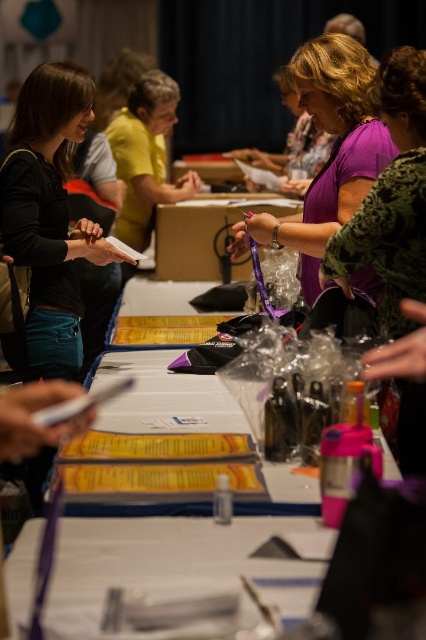
Question: Can you confirm if purple matte shirt at center is positioned below purple matte shirt at upper right?

Choices:
 (A) yes
 (B) no

Answer: (B)

Question: Which object is the closest to the purple matte shirt at upper right?

Choices:
 (A) purple matte shirt at center
 (B) matte yellow shirt at upper center
 (C) yellow paper at center

Answer: (A)

Question: Does purple matte shirt at upper right appear on the right side of matte yellow shirt at upper center?

Choices:
 (A) no
 (B) yes

Answer: (B)

Question: Considering the real-world distances, which object is closest to the purple matte shirt at upper right?

Choices:
 (A) purple matte shirt at center
 (B) matte black shirt at left

Answer: (A)

Question: Does purple matte shirt at center have a larger size compared to purple matte shirt at upper right?

Choices:
 (A) no
 (B) yes

Answer: (B)

Question: Considering the real-world distances, which object is farthest from the matte black shirt at left?

Choices:
 (A) yellow paper at center
 (B) purple matte shirt at upper right
 (C) purple matte shirt at center
 (D) matte yellow shirt at upper center

Answer: (D)